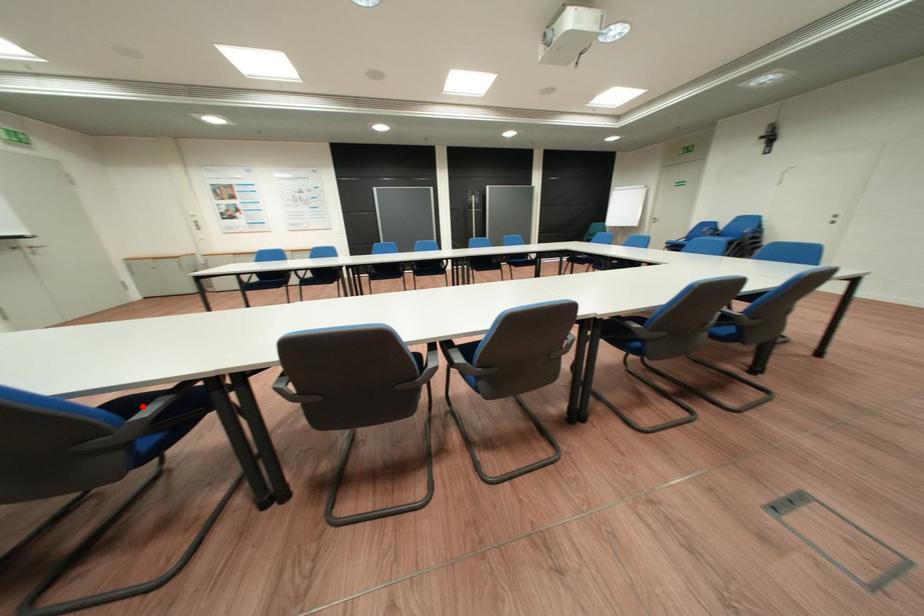
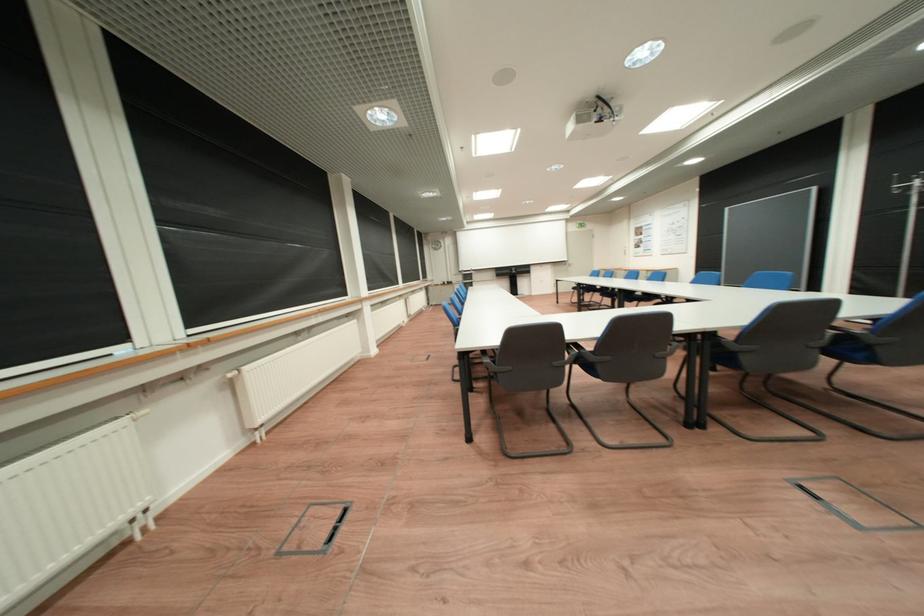
Question: I am providing you with two images of the same scene from different viewpoints. A red point is marked on the first image. At the location where the point appears in image 1, is it still visible in image 2?

Choices:
 (A) Yes
 (B) No

Answer: (B)